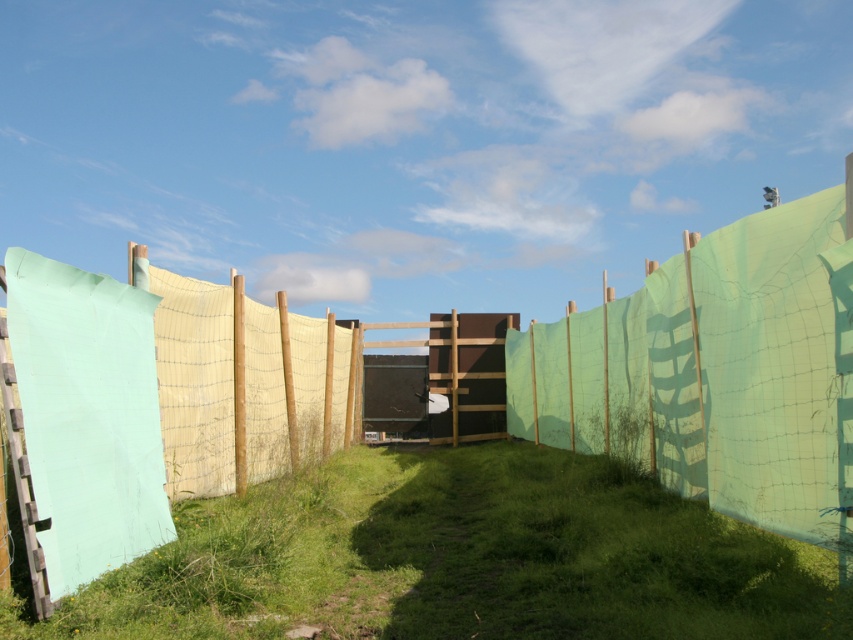
Does point (814, 584) come closer to viewer compared to point (817, 536)?

Yes, it is.

Who is more forward, (728, 618) or (750, 244)?

Point (728, 618) is more forward.

Identify the location of green grassy at center. The width and height of the screenshot is (853, 640). (457, 557).